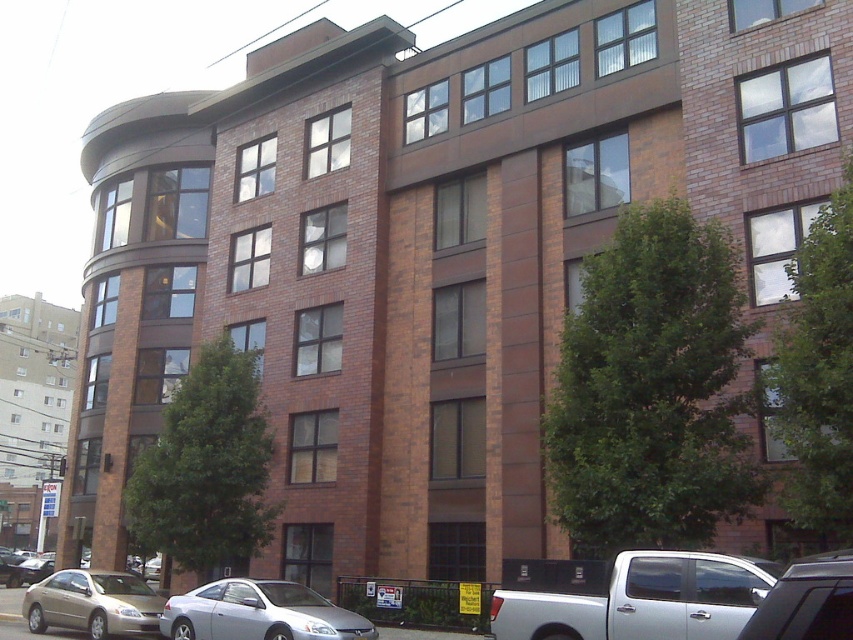
Can you confirm if white matte truck at lower right is wider than silver metallic car at lower center?

Indeed, white matte truck at lower right has a greater width compared to silver metallic car at lower center.

Measure the distance between white matte truck at lower right and camera.

white matte truck at lower right is 28.29 feet away from camera.

This screenshot has height=640, width=853. What are the coordinates of `white matte truck at lower right` in the screenshot? It's located at (635, 596).

Which is more to the left, matte gold sedan at lower left or silver metallic car at lower right?

matte gold sedan at lower left

Which is below, matte gold sedan at lower left or silver metallic car at lower right?

matte gold sedan at lower left is lower down.

From the picture: Measure the distance between matte gold sedan at lower left and camera.

matte gold sedan at lower left is 16.05 meters from camera.

This screenshot has width=853, height=640. I want to click on matte gold sedan at lower left, so click(x=93, y=604).

Is white matte truck at lower right above silver metallic car at lower right?

Correct, white matte truck at lower right is located above silver metallic car at lower right.

You are a GUI agent. You are given a task and a screenshot of the screen. Output one action in this format:
    pyautogui.click(x=<x>, y=<y>)
    Task: Click on the white matte truck at lower right
    The width and height of the screenshot is (853, 640).
    Given the screenshot: What is the action you would take?
    pyautogui.click(x=635, y=596)

Is point (779, 566) farther from camera compared to point (753, 612)?

That is True.

This screenshot has width=853, height=640. I want to click on white matte truck at lower right, so click(635, 596).